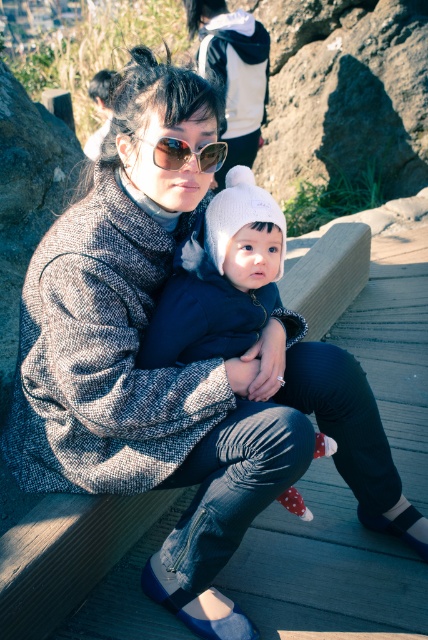
You are a photographer setting up a shot of the two subjects on the bench. You need to ensure the white knit hat at center and sunglasses at center are both in focus. Which object should you adjust your lens focus on first to account for their sizes?

The white knit hat at center is wider than sunglasses at center, so you should focus on the white knit hat at center first to ensure its larger size is properly captured.

You are a photographer standing at a certain distance from the white knit hat at center. You want to take a closeup photo of it without getting too close. Considering the distance between you and the hat, what is the minimum focal length lens you should use if your camera sensor size is 36mm x 24mm and you want to fill the frame with the hat?

The minimum focal length lens required would depend on the desired field of view and the size of the object in the frame. However, since the distance is 7.78 feet, converting that to meters gives approximately 2.37 meters. Using the formula for focal length, Focal Length mm x 0.0393701 inches per mm divided by the sensor size in inches, but without knowing the exact dimensions of the hat, it is difficult to calculate precisely. A rough estimate might suggest a lens around 50mm to 85mm could work, but this 1

You are a photographer trying to capture a closeup of the baby in the scene. You notice two items at the center of the image, the white knit hat at center and sunglasses at center. Which item is positioned more to the right side of the image?

The white knit hat at center is to the right of sunglasses at center, so the white knit hat at center is positioned more to the right side of the image.